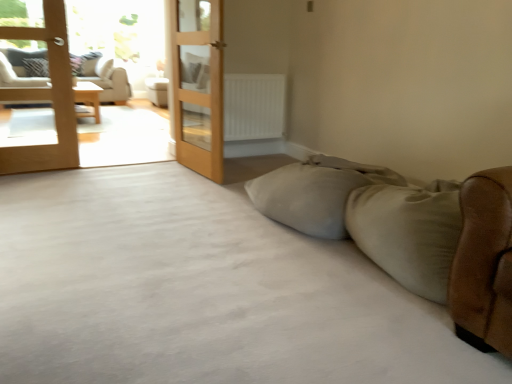
Question: Considering the relative positions of white matte radiator at center and matte white couch at left, which is the first studio couch in top-to-bottom order, in the image provided, is white matte radiator at center to the left or to the right of matte white couch at left, which is the first studio couch in top-to-bottom order,?

Choices:
 (A) right
 (B) left

Answer: (A)

Question: From the image's perspective, is white matte radiator at center located above or below matte white couch at left, which appears as the second studio couch when viewed from the right?

Choices:
 (A) above
 (B) below

Answer: (B)

Question: Which of these objects is positioned closest to the light brown wooden terrace at left?

Choices:
 (A) matte white couch at left, the second studio couch positioned from the bottom
 (B) light brown wooden door at center, the first door when ordered from right to left
 (C) brown leather studio couch at right, placed as the 2th studio couch when sorted from left to right
 (D) wooden table at left
 (E) light brown wooden door at left, marked as the 2th door in a right-to-left arrangement

Answer: (E)

Question: Considering the real-world distances, which object is closest to the matte white side table at center?

Choices:
 (A) light brown wooden terrace at left
 (B) white matte radiator at center
 (C) light brown wooden door at center, the first door when ordered from right to left
 (D) wooden table at left
 (E) brown leather studio couch at right, which appears as the first studio couch when viewed from the right

Answer: (D)